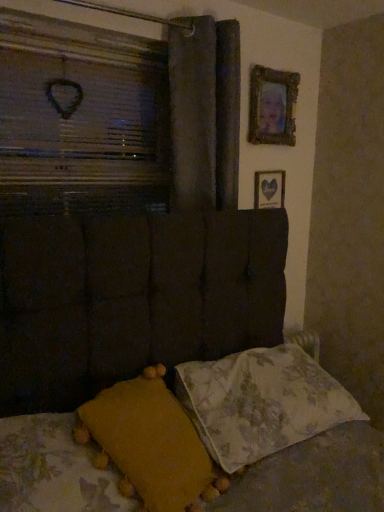
The image size is (384, 512). What do you see at coordinates (81, 116) in the screenshot?
I see `wooden heart at upper left` at bounding box center [81, 116].

Image resolution: width=384 pixels, height=512 pixels. I want to click on wooden heart at upper left, so click(81, 116).

What is the approximate width of floral fabric pillow at lower right, acting as the second pillow starting from the left?

The width of floral fabric pillow at lower right, acting as the second pillow starting from the left, is 16.88 inches.

Locate an element on the screen. The height and width of the screenshot is (512, 384). gold-framed picture at upper right, which ranks as the second picture frame in bottom-to-top order is located at coordinates point(272,106).

Is mustard yellow fabric pillow at lower left, which is counted as the first pillow, starting from the left, next to dark fabric curtain at upper center?

No, mustard yellow fabric pillow at lower left, which is counted as the first pillow, starting from the left, is not making contact with dark fabric curtain at upper center.

From a real-world perspective, which object rests below the other?

mustard yellow fabric pillow at lower left, which appears as the 2th pillow when viewed from the right.

Consider the image. From the image's perspective, would you say mustard yellow fabric pillow at lower left, which appears as the 2th pillow when viewed from the right, is shown under dark fabric curtain at upper center?

Yes, from the image's perspective, mustard yellow fabric pillow at lower left, which appears as the 2th pillow when viewed from the right, is beneath dark fabric curtain at upper center.

Is mustard yellow fabric pillow at lower left, which is counted as the first pillow, starting from the left, facing away from dark fabric curtain at upper center?

No.

Does floral fabric pillow at lower right, which is the 1th pillow in right-to-left order, touch wooden heart at upper left?

No, floral fabric pillow at lower right, which is the 1th pillow in right-to-left order, is not making contact with wooden heart at upper left.

From a real-world perspective, is floral fabric pillow at lower right, which is the 1th pillow in right-to-left order, located higher than wooden heart at upper left?

Incorrect, from a real-world perspective, floral fabric pillow at lower right, which is the 1th pillow in right-to-left order, is lower than wooden heart at upper left.

Can we say floral fabric pillow at lower right, which is the 1th pillow in right-to-left order, lies outside wooden heart at upper left?

That's correct, floral fabric pillow at lower right, which is the 1th pillow in right-to-left order, is outside of wooden heart at upper left.

Identify the location of curtain that is under the gold-framed picture at upper right, the 1th picture frame in the top-to-bottom sequence (from a real-world perspective). Image resolution: width=384 pixels, height=512 pixels. 193,112.

Is gold-framed picture at upper right, the 1th picture frame in the top-to-bottom sequence, taller than dark fabric curtain at upper center?

No, gold-framed picture at upper right, the 1th picture frame in the top-to-bottom sequence, is not taller than dark fabric curtain at upper center.

Is gold-framed picture at upper right, which ranks as the second picture frame in bottom-to-top order, turned away from dark fabric curtain at upper center?

That's not correct — gold-framed picture at upper right, which ranks as the second picture frame in bottom-to-top order, is not looking away from dark fabric curtain at upper center.

How much distance is there between gold-framed picture at upper right, the 1th picture frame in the top-to-bottom sequence, and dark fabric curtain at upper center?

17.89 inches.

Which is farther, (262, 117) or (230, 409)?

Point (262, 117)

Is gold-framed picture at upper right, which ranks as the second picture frame in bottom-to-top order, to the left or to the right of floral fabric pillow at lower right, which is the 1th pillow in right-to-left order, in the image?

gold-framed picture at upper right, which ranks as the second picture frame in bottom-to-top order, is to the right of floral fabric pillow at lower right, which is the 1th pillow in right-to-left order.

Is gold-framed picture at upper right, the 1th picture frame in the top-to-bottom sequence, further to the viewer compared to floral fabric pillow at lower right, acting as the second pillow starting from the left?

Yes, gold-framed picture at upper right, the 1th picture frame in the top-to-bottom sequence, is behind floral fabric pillow at lower right, acting as the second pillow starting from the left.

This screenshot has height=512, width=384. I want to click on the 2nd picture frame above the floral fabric pillow at lower right, acting as the second pillow starting from the left (from a real-world perspective), so click(272, 106).

Is floral fabric pillow at lower right, acting as the second pillow starting from the left, taller or shorter than wooden picture frame at upper right, which is the first picture frame from bottom to top?

In the image, floral fabric pillow at lower right, acting as the second pillow starting from the left, appears to be shorter than wooden picture frame at upper right, which is the first picture frame from bottom to top.

Are floral fabric pillow at lower right, which is the 1th pillow in right-to-left order, and wooden picture frame at upper right, placed as the 2th picture frame when sorted from top to bottom, located far from each other?

floral fabric pillow at lower right, which is the 1th pillow in right-to-left order, is actually quite close to wooden picture frame at upper right, placed as the 2th picture frame when sorted from top to bottom.

Looking at their sizes, would you say floral fabric pillow at lower right, acting as the second pillow starting from the left, is wider or thinner than wooden picture frame at upper right, placed as the 2th picture frame when sorted from top to bottom?

floral fabric pillow at lower right, acting as the second pillow starting from the left, is wider than wooden picture frame at upper right, placed as the 2th picture frame when sorted from top to bottom.

From a real-world perspective, is floral fabric pillow at lower right, which is the 1th pillow in right-to-left order, physically located above or below wooden picture frame at upper right, which is the first picture frame from bottom to top?

In terms of real-world spatial position, floral fabric pillow at lower right, which is the 1th pillow in right-to-left order, is below wooden picture frame at upper right, which is the first picture frame from bottom to top.

In the scene shown: Is dark fabric curtain at upper center turned away from wooden picture frame at upper right, placed as the 2th picture frame when sorted from top to bottom?

No, dark fabric curtain at upper center is not facing the opposite direction of wooden picture frame at upper right, placed as the 2th picture frame when sorted from top to bottom.

Looking at this image, in the image, is dark fabric curtain at upper center positioned in front of or behind wooden picture frame at upper right, placed as the 2th picture frame when sorted from top to bottom?

dark fabric curtain at upper center is positioned closer to the viewer than wooden picture frame at upper right, placed as the 2th picture frame when sorted from top to bottom.

Can you confirm if dark fabric curtain at upper center is taller than wooden picture frame at upper right, which is the first picture frame from bottom to top?

Yes.

Is dark fabric curtain at upper center smaller than wooden picture frame at upper right, placed as the 2th picture frame when sorted from top to bottom?

No.

Can you confirm if wooden heart at upper left is shorter than gold-framed picture at upper right, which ranks as the second picture frame in bottom-to-top order?

No, wooden heart at upper left is not shorter than gold-framed picture at upper right, which ranks as the second picture frame in bottom-to-top order.

Is point (79, 154) positioned in front of point (295, 101)?

Yes, point (79, 154) is closer to viewer.

Can you confirm if wooden heart at upper left is positioned to the right of gold-framed picture at upper right, the 1th picture frame in the top-to-bottom sequence?

Incorrect, wooden heart at upper left is not on the right side of gold-framed picture at upper right, the 1th picture frame in the top-to-bottom sequence.

Identify the location of the 2nd pillow below the dark fabric curtain at upper center (from the image's perspective). Image resolution: width=384 pixels, height=512 pixels. pyautogui.click(x=151, y=443).

Find the location of `window screen above the floral fabric pillow at lower right, which is the 1th pillow in right-to-left order (from the image's perspective)`. window screen above the floral fabric pillow at lower right, which is the 1th pillow in right-to-left order (from the image's perspective) is located at coordinates (81, 116).

Looking at the image, which one is located further to wooden picture frame at upper right, which is the first picture frame from bottom to top, mustard yellow fabric pillow at lower left, which appears as the 2th pillow when viewed from the right, or dark fabric curtain at upper center?

mustard yellow fabric pillow at lower left, which appears as the 2th pillow when viewed from the right, is further to wooden picture frame at upper right, which is the first picture frame from bottom to top.

From the image, which object appears to be nearer to floral fabric pillow at lower right, acting as the second pillow starting from the left, mustard yellow fabric pillow at lower left, which appears as the 2th pillow when viewed from the right, or gold-framed picture at upper right, the 1th picture frame in the top-to-bottom sequence?

mustard yellow fabric pillow at lower left, which appears as the 2th pillow when viewed from the right.

Looking at the image, which one is located further to mustard yellow fabric pillow at lower left, which is counted as the first pillow, starting from the left, floral fabric pillow at lower right, acting as the second pillow starting from the left, or wooden picture frame at upper right, placed as the 2th picture frame when sorted from top to bottom?

The object further to mustard yellow fabric pillow at lower left, which is counted as the first pillow, starting from the left, is wooden picture frame at upper right, placed as the 2th picture frame when sorted from top to bottom.

From the image, which object appears to be nearer to dark fabric curtain at upper center, wooden heart at upper left or floral fabric pillow at lower right, acting as the second pillow starting from the left?

wooden heart at upper left lies closer to dark fabric curtain at upper center than the other object.

From the image, which object appears to be nearer to floral fabric pillow at lower right, acting as the second pillow starting from the left, wooden picture frame at upper right, placed as the 2th picture frame when sorted from top to bottom, or mustard yellow fabric pillow at lower left, which appears as the 2th pillow when viewed from the right?

Among the two, mustard yellow fabric pillow at lower left, which appears as the 2th pillow when viewed from the right, is located nearer to floral fabric pillow at lower right, acting as the second pillow starting from the left.

Looking at the image, which one is located further to gold-framed picture at upper right, which ranks as the second picture frame in bottom-to-top order, wooden heart at upper left or floral fabric pillow at lower right, which is the 1th pillow in right-to-left order?

floral fabric pillow at lower right, which is the 1th pillow in right-to-left order, lies further to gold-framed picture at upper right, which ranks as the second picture frame in bottom-to-top order, than the other object.

Based on their spatial positions, is floral fabric pillow at lower right, which is the 1th pillow in right-to-left order, or wooden picture frame at upper right, which is the first picture frame from bottom to top, closer to wooden heart at upper left?

wooden picture frame at upper right, which is the first picture frame from bottom to top.

From the image, which object appears to be nearer to wooden picture frame at upper right, which is the first picture frame from bottom to top, gold-framed picture at upper right, the 1th picture frame in the top-to-bottom sequence, or dark fabric curtain at upper center?

gold-framed picture at upper right, the 1th picture frame in the top-to-bottom sequence, is closer to wooden picture frame at upper right, which is the first picture frame from bottom to top.

Where is `window screen between gold-framed picture at upper right, the 1th picture frame in the top-to-bottom sequence, and floral fabric pillow at lower right, which is the 1th pillow in right-to-left order, from top to bottom`? window screen between gold-framed picture at upper right, the 1th picture frame in the top-to-bottom sequence, and floral fabric pillow at lower right, which is the 1th pillow in right-to-left order, from top to bottom is located at coordinates (81, 116).

Where is `window screen between gold-framed picture at upper right, the 1th picture frame in the top-to-bottom sequence, and mustard yellow fabric pillow at lower left, which is counted as the first pillow, starting from the left, in the vertical direction`? window screen between gold-framed picture at upper right, the 1th picture frame in the top-to-bottom sequence, and mustard yellow fabric pillow at lower left, which is counted as the first pillow, starting from the left, in the vertical direction is located at coordinates (81, 116).

Identify the location of picture frame located between wooden heart at upper left and wooden picture frame at upper right, placed as the 2th picture frame when sorted from top to bottom, in the left-right direction. Image resolution: width=384 pixels, height=512 pixels. (272, 106).

Where is `picture frame between dark fabric curtain at upper center and floral fabric pillow at lower right, acting as the second pillow starting from the left, from top to bottom`? This screenshot has height=512, width=384. picture frame between dark fabric curtain at upper center and floral fabric pillow at lower right, acting as the second pillow starting from the left, from top to bottom is located at coordinates (269, 189).